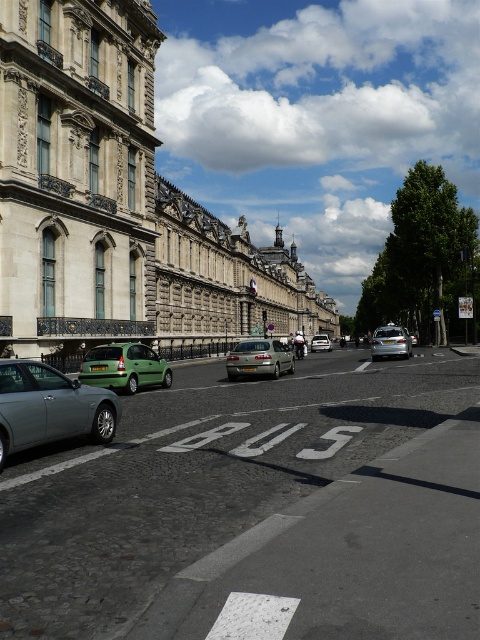
Question: Is matte silver car at center above beige stone building at upper center?

Choices:
 (A) yes
 (B) no

Answer: (B)

Question: Which point appears closest to the camera in this image?

Choices:
 (A) (69, 388)
 (B) (244, 349)
 (C) (386, 342)
 (D) (192, 420)

Answer: (A)

Question: Which point is farther to the camera?

Choices:
 (A) (50, 403)
 (B) (115, 60)

Answer: (B)

Question: Does matte silver car at center have a greater width compared to satin silver sedan at center?

Choices:
 (A) yes
 (B) no

Answer: (A)

Question: Does silver metallic car at right appear under silver metallic sedan at center?

Choices:
 (A) yes
 (B) no

Answer: (B)

Question: Which object is the closest to the beige stone building at upper center?

Choices:
 (A) silver metallic car at right
 (B) silver metallic car at lower left
 (C) silver metallic sedan at center

Answer: (C)